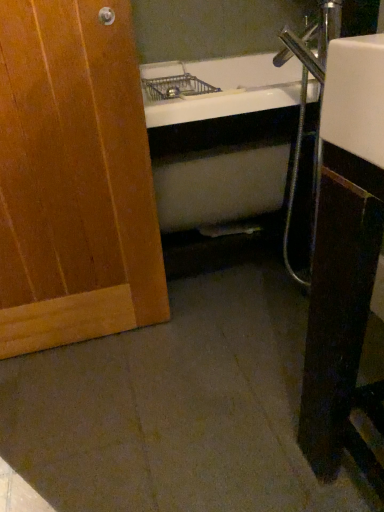
Where is `free space to the right of wooden door at left`? This screenshot has height=512, width=384. free space to the right of wooden door at left is located at coordinates (196, 353).